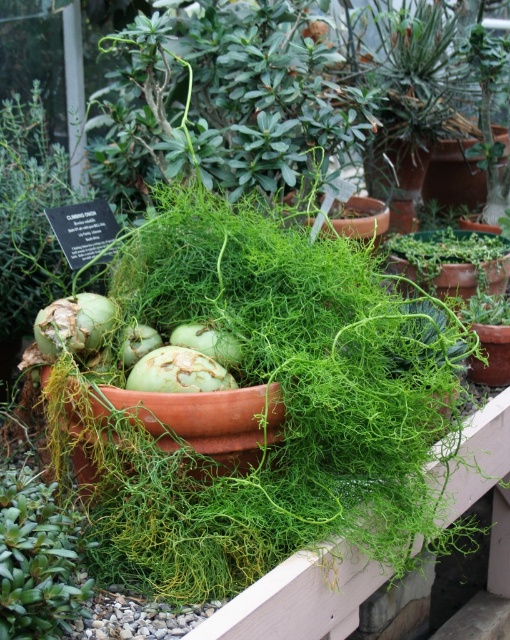
Between point (225, 372) and point (186, 342), which one is positioned in front?

Positioned in front is point (225, 372).

Between green matte vegetable at center and green matte fennel bulb at center, which one has more height?

With more height is green matte fennel bulb at center.

This screenshot has height=640, width=510. Find the location of `green matte vegetable at center`. green matte vegetable at center is located at coordinates (178, 371).

Which is behind, point (89, 337) or point (211, 328)?

Positioned behind is point (89, 337).

The width and height of the screenshot is (510, 640). I want to click on green matte coconut at center, so click(73, 324).

In the scene shown: Who is positioned more to the left, green matte coconut at center or green matte vegetable at center?

Result: green matte coconut at center is more to the left.

Who is more forward, (46, 328) or (140, 378)?

Positioned in front is point (140, 378).

At what (x,y) coordinates should I click in order to perform the action: click on green matte coconut at center. Please return your answer as a coordinate pair (x, y). This screenshot has height=640, width=510. Looking at the image, I should click on (73, 324).